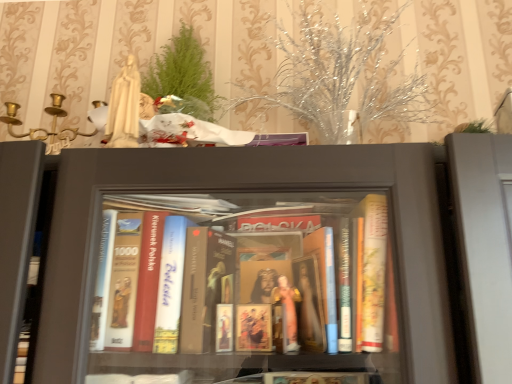
The width and height of the screenshot is (512, 384). What do you see at coordinates (343, 75) in the screenshot? I see `sparkly silver branches at upper center` at bounding box center [343, 75].

Locate an element on the screen. sparkly silver branches at upper center is located at coordinates (343, 75).

Locate an element on the screen. The height and width of the screenshot is (384, 512). sparkly silver branches at upper center is located at coordinates (343, 75).